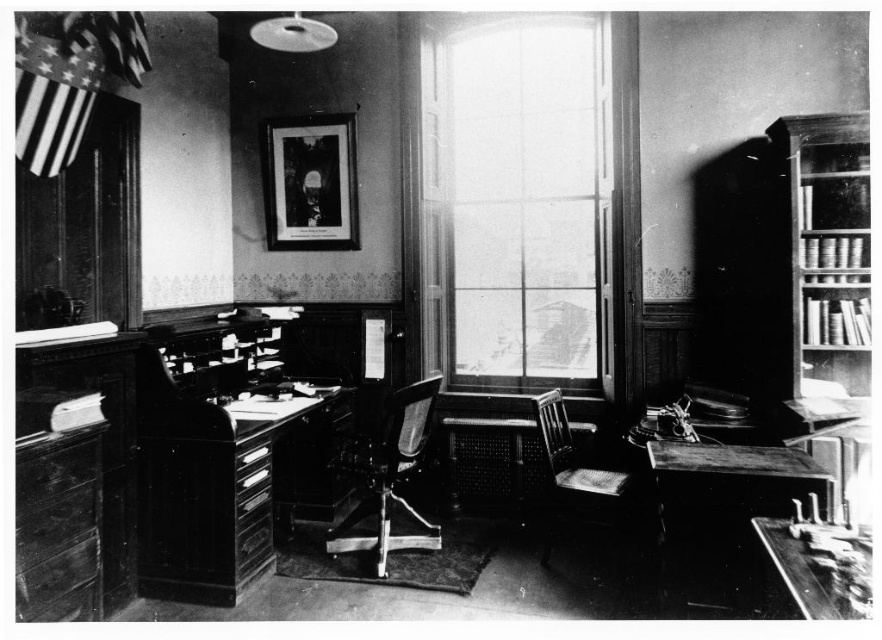
Between point (323, 419) and point (729, 468), which one is positioned behind?

Point (323, 419)

This screenshot has height=640, width=882. Describe the element at coordinates (214, 488) in the screenshot. I see `wooden desk at center` at that location.

Is point (226, 522) more distant than point (678, 550)?

Yes, point (226, 522) is behind point (678, 550).

At what (x,y) coordinates should I click in order to perform the action: click on wooden desk at center. Please return your answer as a coordinate pair (x, y). Image resolution: width=882 pixels, height=640 pixels. Looking at the image, I should click on (214, 488).

Who is lower down, transparent glass window at center or wooden chair at center?

Positioned lower is wooden chair at center.

Can you confirm if transparent glass window at center is smaller than wooden chair at center?

Incorrect, transparent glass window at center is not smaller in size than wooden chair at center.

Does point (486, 163) come behind point (579, 481)?

Yes, it is behind point (579, 481).

At what (x,y) coordinates should I click in order to perform the action: click on transparent glass window at center. Please return your answer as a coordinate pair (x, y). This screenshot has height=640, width=882. Looking at the image, I should click on (516, 200).

Can you confirm if wooden bookshelf at right is taller than metallic polished chair at center?

Indeed, wooden bookshelf at right has a greater height compared to metallic polished chair at center.

What do you see at coordinates (821, 250) in the screenshot? The image size is (882, 640). I see `wooden bookshelf at right` at bounding box center [821, 250].

Find the location of `wooden bookshelf at right`. wooden bookshelf at right is located at coordinates tap(821, 250).